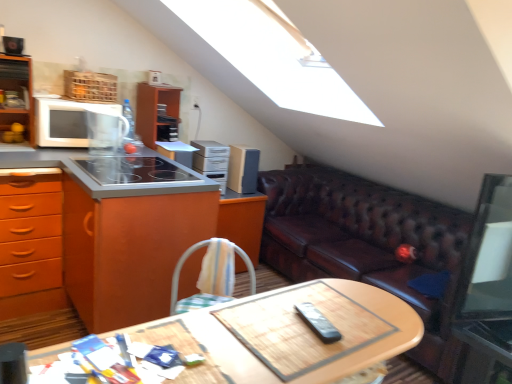
The image size is (512, 384). In order to click on free space that is to the left of black plastic remote at center, the fourth appliance in the left-to-right sequence in this screenshot , I will do (x=265, y=324).